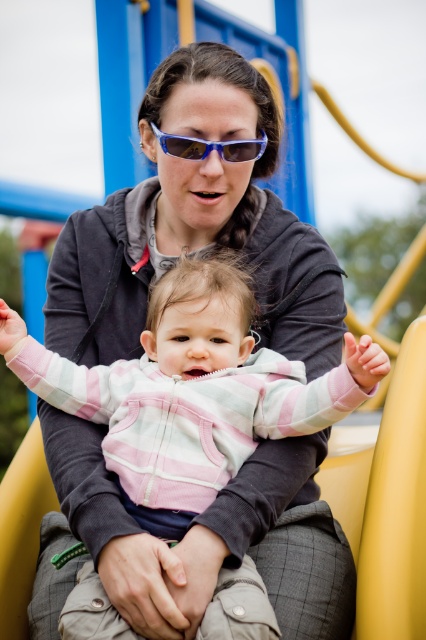
Question: Is pink striped fleece at center to the right of blue plastic goggles at center from the viewer's perspective?

Choices:
 (A) no
 (B) yes

Answer: (A)

Question: Which object appears farthest from the camera in this image?

Choices:
 (A) pink striped fleece at center
 (B) blue plastic goggles at center

Answer: (B)

Question: Does pink striped fleece at center appear on the right side of blue plastic goggles at center?

Choices:
 (A) yes
 (B) no

Answer: (B)

Question: Which object appears closest to the camera in this image?

Choices:
 (A) pink striped fleece at center
 (B) blue plastic goggles at center

Answer: (A)

Question: Does pink striped fleece at center have a greater width compared to blue plastic goggles at center?

Choices:
 (A) no
 (B) yes

Answer: (B)